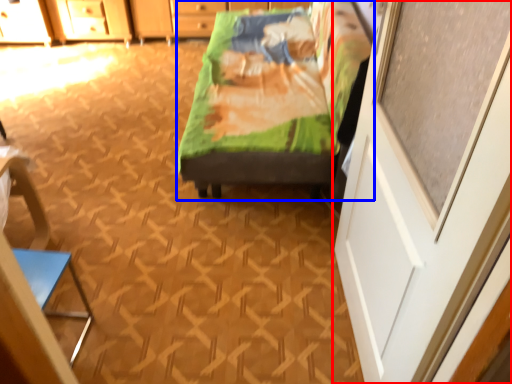
Question: Which point is closer to the camera, screen door (highlighted by a red box) or furniture (highlighted by a blue box)?

Choices:
 (A) screen door
 (B) furniture

Answer: (A)